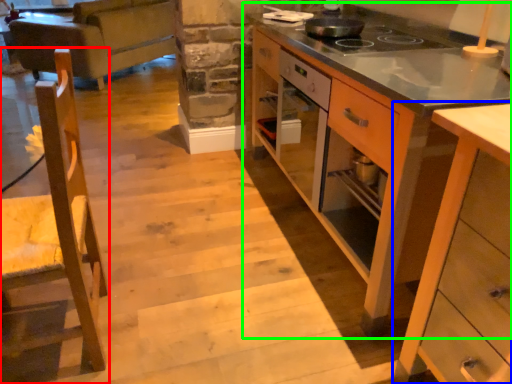
Question: Based on their relative distances, which object is nearer to chair (highlighted by a red box)? Choose from cabinetry (highlighted by a blue box) and cabinetry (highlighted by a green box).

Choices:
 (A) cabinetry
 (B) cabinetry

Answer: (A)